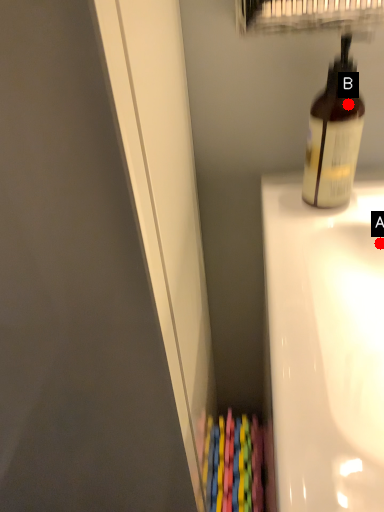
Question: Two points are circled on the image, labeled by A and B beside each circle. Which point appears farthest from the camera in this image?

Choices:
 (A) A is further
 (B) B is further

Answer: (A)